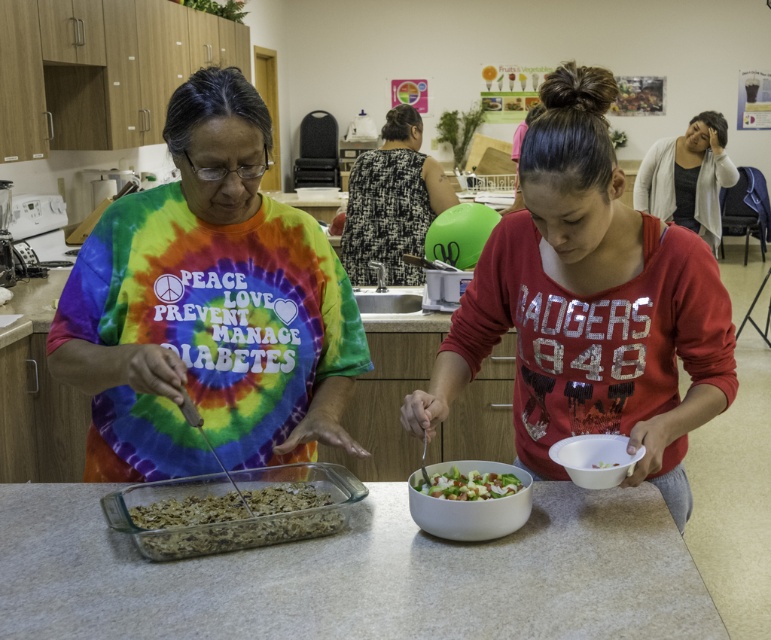
You are a photographer at the event and need to capture a closeup of the black textured dress at center and the white plastic bowl at lower right. Since you can only focus on one object at a time, which object should you choose to ensure the other is still in the background but recognizable?

You should focus on the black textured dress at center because it is larger than the white plastic bowl at lower right, so even if it is in focus, the smaller white plastic bowl at lower right will still be recognizable in the background.

You are a nutritionist attending a diabetes awareness event and need to recommend a container for a salad. The white plastic bowl at lower right and the green leafy salad at center are available. Which container is taller?

The white plastic bowl at lower right is taller than the green leafy salad at center.

Consider the image. What is located at the coordinate point (x=357, y=573) in the scene?

The white laminate counter at center is located at the coordinate point (x=357, y=573).